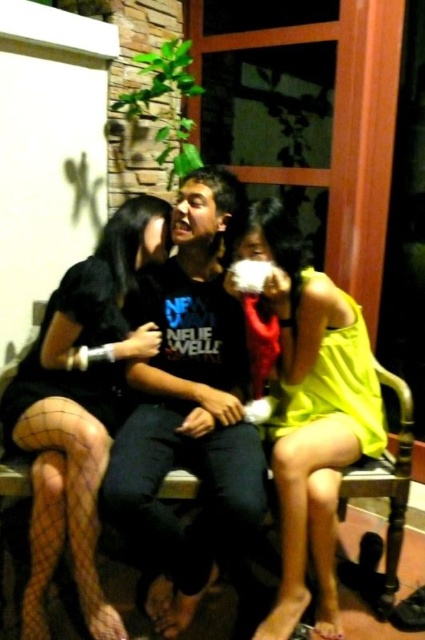
Based on the photo, looking at the two black items in the scene, the black matte shirt at center and the black mesh stockings at lower left, which one is positioned to the right of the other?

The black matte shirt at center is to the right of the black mesh stockings at lower left.

You are a fashion designer observing the three people sitting on the bench. You notice two yellow dresses among them. Which one is taller between the yellow matte dress at center and the yellow satin dress at right?

The yellow matte dress at center is taller than the yellow satin dress at right.

You are a fashion designer observing the three people on the bench. You need to determine which clothing item, the yellow matte dress at center or the black mesh stockings at lower left, would require more fabric to create. Based on the description, which one would need more material?

The yellow matte dress at center is larger in size than the black mesh stockings at lower left, so it would require more fabric to create.